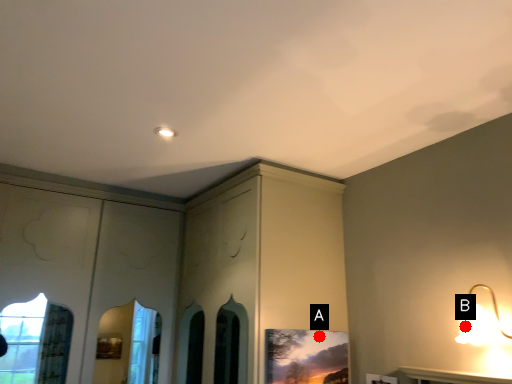
Question: Two points are circled on the image, labeled by A and B beside each circle. Which point is farther from the camera taking this photo?

Choices:
 (A) A is further
 (B) B is further

Answer: (A)